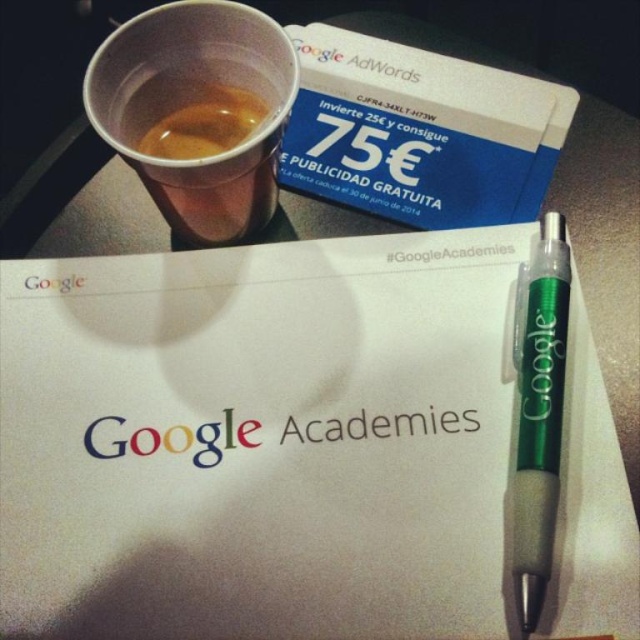
You are a GUI agent. You are given a task and a screenshot of the screen. Output one action in this format:
    pyautogui.click(x=<x>, y=<y>)
    Task: Click on the white paper at center
    
    Given the screenshot: What is the action you would take?
    pyautogui.click(x=259, y=440)

Which is above, white paper at center or green translucent pen at lower right?

green translucent pen at lower right is higher up.

Is point (275, 435) behind point (550, 513)?

That is True.

This screenshot has height=640, width=640. I want to click on white paper at center, so click(x=259, y=440).

Which is behind, point (124, 529) or point (196, 20)?

Positioned behind is point (196, 20).

Is white paper at center thinner than translucent plastic cup at upper left?

In fact, white paper at center might be wider than translucent plastic cup at upper left.

Who is more forward, [378,413] or [224,4]?

Point [378,413]

Find the location of a particular element. This screenshot has height=640, width=640. white paper at center is located at coordinates (259, 440).

Does translucent plastic cup at upper left have a smaller size compared to green translucent pen at lower right?

Incorrect, translucent plastic cup at upper left is not smaller in size than green translucent pen at lower right.

What do you see at coordinates (193, 100) in the screenshot? This screenshot has height=640, width=640. I see `translucent plastic cup at upper left` at bounding box center [193, 100].

You are a GUI agent. You are given a task and a screenshot of the screen. Output one action in this format:
    pyautogui.click(x=<x>, y=<y>)
    Task: Click on the translucent plastic cup at upper left
    Image resolution: width=640 pixels, height=640 pixels.
    Given the screenshot: What is the action you would take?
    pyautogui.click(x=193, y=100)